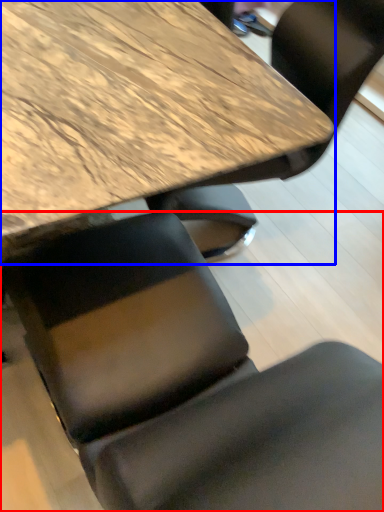
Question: Which object appears closest to the camera in this image, chair (highlighted by a red box) or table (highlighted by a blue box)?

Choices:
 (A) chair
 (B) table

Answer: (A)